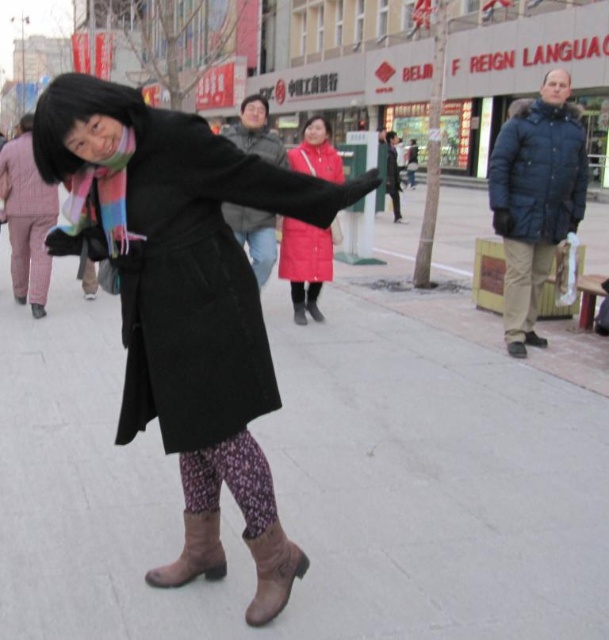
Which is more to the right, dark blue down jacket at right or plaid fabric pants at left?

Positioned to the right is dark blue down jacket at right.

Can you confirm if dark blue down jacket at right is positioned below plaid fabric pants at left?

Incorrect, dark blue down jacket at right is not positioned below plaid fabric pants at left.

Locate an element on the screen. dark blue down jacket at right is located at coordinates (538, 173).

Is khaki cotton pants at right bigger than plaid fabric pants at left?

Actually, khaki cotton pants at right might be smaller than plaid fabric pants at left.

Based on the photo, how far apart are khaki cotton pants at right and plaid fabric pants at left?

4.71 meters

At what (x,y) coordinates should I click in order to perform the action: click on khaki cotton pants at right. Please return your answer as a coordinate pair (x, y). This screenshot has height=640, width=609. Looking at the image, I should click on (523, 289).

Does khaki cotton pants at right have a smaller size compared to jeans at center?

Incorrect, khaki cotton pants at right is not smaller in size than jeans at center.

Is point (518, 332) farther from viewer compared to point (272, 228)?

No, (518, 332) is closer to viewer.

The width and height of the screenshot is (609, 640). In order to click on khaki cotton pants at right in this screenshot , I will do `click(523, 289)`.